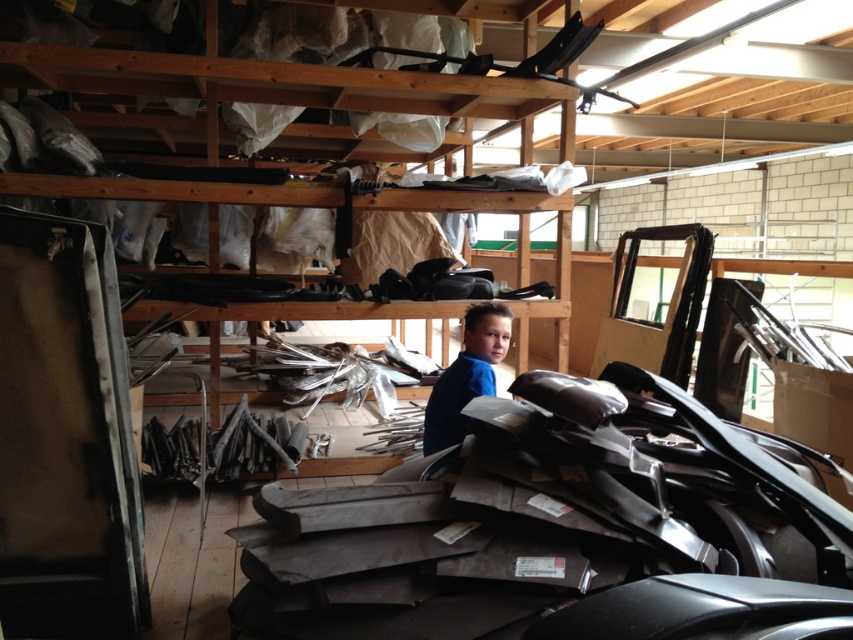
Question: Is wooden shelves at center thinner than blue matte shirt at center?

Choices:
 (A) yes
 (B) no

Answer: (B)

Question: Can you confirm if wooden shelves at center is smaller than blue matte shirt at center?

Choices:
 (A) no
 (B) yes

Answer: (A)

Question: Which of the following is the farthest from the observer?

Choices:
 (A) (468, 394)
 (B) (254, 196)

Answer: (B)

Question: Among these objects, which one is nearest to the camera?

Choices:
 (A) blue matte shirt at center
 (B) wooden shelves at center

Answer: (A)

Question: Does wooden shelves at center have a smaller size compared to blue matte shirt at center?

Choices:
 (A) yes
 (B) no

Answer: (B)

Question: Which point is farther from the camera taking this photo?

Choices:
 (A) (463, 93)
 (B) (482, 301)

Answer: (A)